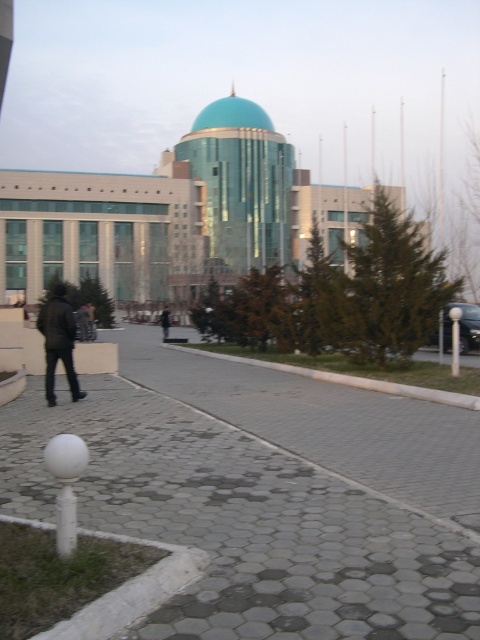
Does gray hexagonal paving at center have a lesser height compared to black leather jacket at center?

Yes.

Who is more distant from viewer, (35, 516) or (167, 326)?

Point (167, 326)

Locate an element on the screen. The height and width of the screenshot is (640, 480). gray hexagonal paving at center is located at coordinates (268, 493).

Which of these two, gray hexagonal paving at center or dark brown leather jacket at left, stands shorter?

gray hexagonal paving at center

Based on the photo, is gray hexagonal paving at center taller than dark brown leather jacket at left?

In fact, gray hexagonal paving at center may be shorter than dark brown leather jacket at left.

Who is more forward, (233, 436) or (63, 317)?

Positioned in front is point (233, 436).

You are a GUI agent. You are given a task and a screenshot of the screen. Output one action in this format:
    pyautogui.click(x=<x>, y=<y>)
    Task: Click on the gray hexagonal paving at center
    The image size is (480, 640).
    Given the screenshot: What is the action you would take?
    pyautogui.click(x=268, y=493)

The width and height of the screenshot is (480, 640). What do you see at coordinates (59, 340) in the screenshot? I see `dark brown leather jacket at left` at bounding box center [59, 340].

Between dark brown leather jacket at left and black leather jacket at center, which one is positioned lower?

black leather jacket at center

Does point (44, 333) lie behind point (164, 330)?

No, (44, 333) is in front of (164, 330).

You are a GUI agent. You are given a task and a screenshot of the screen. Output one action in this format:
    pyautogui.click(x=<x>, y=<y>)
    Task: Click on the dark brown leather jacket at left
    This screenshot has height=640, width=480.
    Given the screenshot: What is the action you would take?
    pyautogui.click(x=59, y=340)